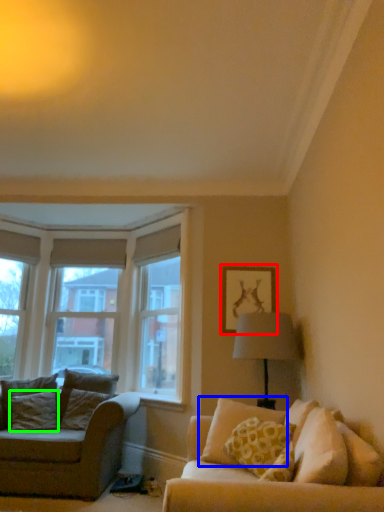
Question: Based on their relative distances, which object is nearer to picture frame (highlighted by a red box)? Choose from pillow (highlighted by a blue box) and pillow (highlighted by a green box).

Choices:
 (A) pillow
 (B) pillow

Answer: (A)